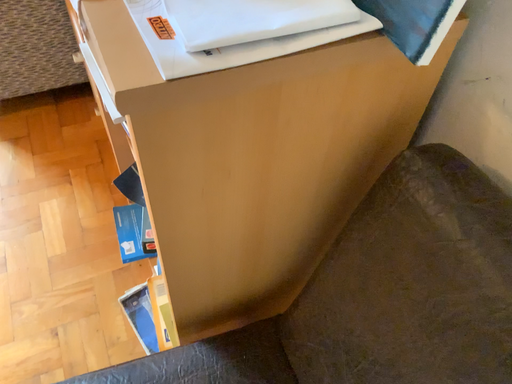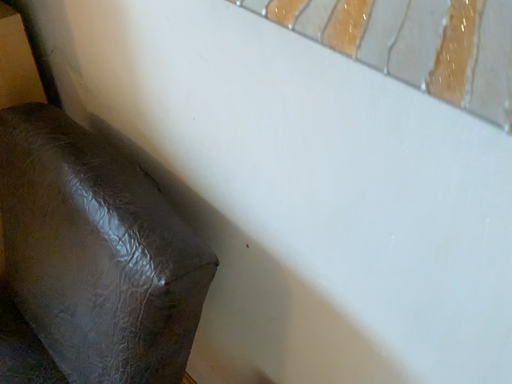
Question: Which way did the camera rotate in the video?

Choices:
 (A) rotated left
 (B) rotated right

Answer: (B)